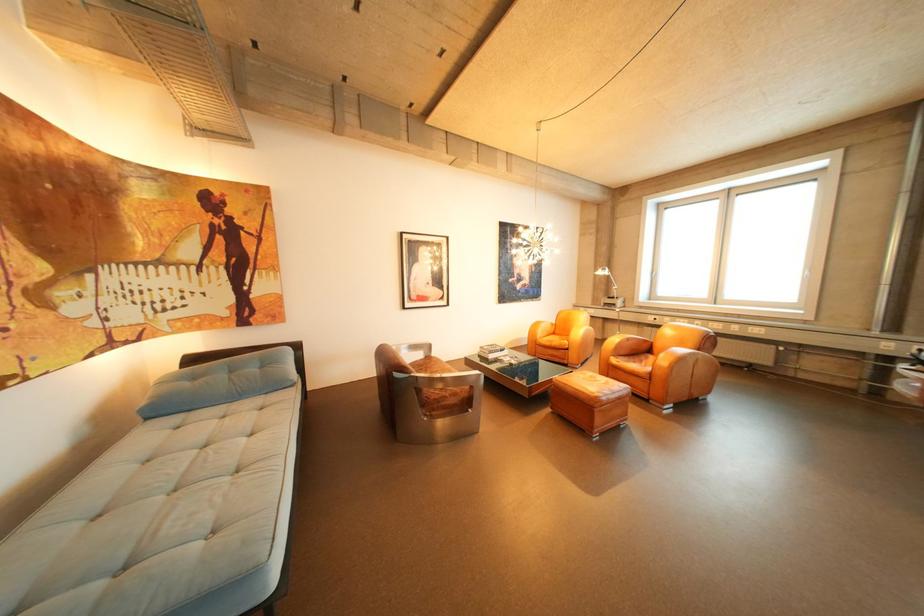
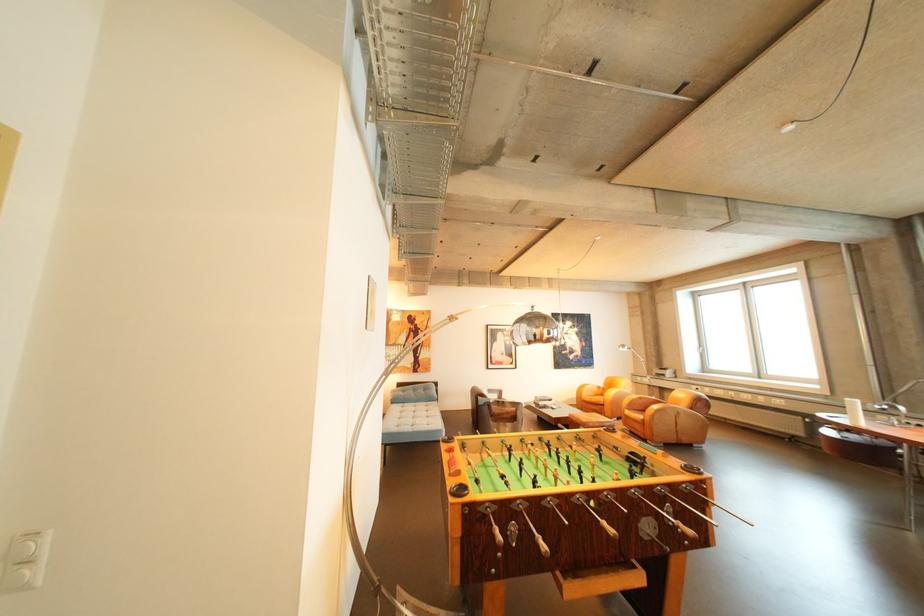
Where in the second image is the point corresponding to the point at 552,336 from the first image?

(598, 395)